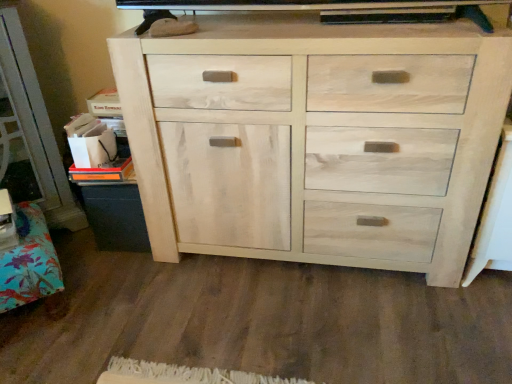
Question: Can you confirm if natural wood cabinet at center is positioned to the left of natural wood cabinet at lower left?

Choices:
 (A) yes
 (B) no

Answer: (B)

Question: Does natural wood cabinet at center appear on the right side of natural wood cabinet at lower left?

Choices:
 (A) yes
 (B) no

Answer: (A)

Question: Would you say natural wood cabinet at center is outside natural wood cabinet at lower left?

Choices:
 (A) yes
 (B) no

Answer: (A)

Question: Is natural wood cabinet at center behind natural wood cabinet at lower left?

Choices:
 (A) yes
 (B) no

Answer: (B)

Question: Does natural wood cabinet at center have a greater width compared to natural wood cabinet at lower left?

Choices:
 (A) no
 (B) yes

Answer: (A)

Question: Is natural wood cabinet at lower left at the back of natural wood cabinet at center?

Choices:
 (A) yes
 (B) no

Answer: (B)

Question: Can you see natural wood cabinet at lower left touching natural wood cabinet at center?

Choices:
 (A) no
 (B) yes

Answer: (A)

Question: Is natural wood cabinet at lower left not close to natural wood cabinet at center?

Choices:
 (A) no
 (B) yes

Answer: (A)

Question: Does natural wood cabinet at lower left have a greater height compared to natural wood cabinet at center?

Choices:
 (A) yes
 (B) no

Answer: (B)

Question: Considering the relative sizes of natural wood cabinet at lower left and natural wood cabinet at center in the image provided, is natural wood cabinet at lower left bigger than natural wood cabinet at center?

Choices:
 (A) yes
 (B) no

Answer: (B)

Question: Can you confirm if natural wood cabinet at lower left is positioned to the right of natural wood cabinet at center?

Choices:
 (A) no
 (B) yes

Answer: (A)

Question: Is natural wood cabinet at lower left thinner than natural wood cabinet at center?

Choices:
 (A) yes
 (B) no

Answer: (B)

Question: Is point (37, 278) closer or farther from the camera than point (286, 99)?

Choices:
 (A) closer
 (B) farther

Answer: (B)